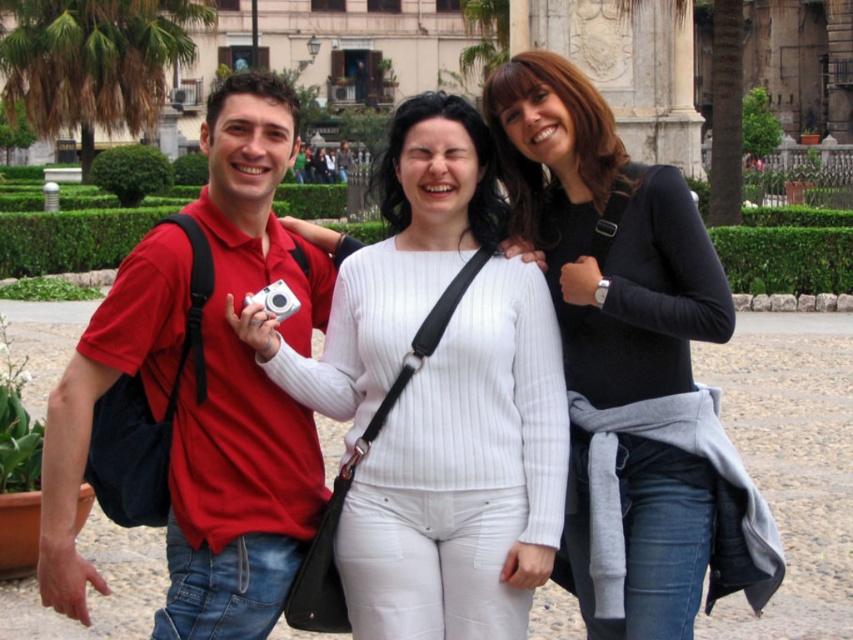
You are a photographer trying to capture a candid shot of the two people in the scene. You want to ensure that both the white ribbed sweater at center and the silver metallic camera at center are clearly visible in the frame. Given their sizes, which object should you focus on to ensure both are in focus?

Since the white ribbed sweater at center is wider than the silver metallic camera at center, you should focus on the white ribbed sweater at center to ensure both objects are in focus as it takes up more space in the frame.

You are standing at the point labeled as point (270, 545) in the image. A friend is located at your current position and wants to throw a frisbee to you. They have a frisbee that can travel up to 30 meters. Will they be able to reach you?

The distance between point (270, 545) and the viewer is 27.45 meters. Since the frisbee can travel up to 30 meters, your friend can successfully throw it to you.

You are standing in the public square and want to take a photo of the two points mentioned. Which point is closer to you, point (662, 188) or point (294, 308)?

Point (662, 188) is closer to the viewer than point (294, 308).